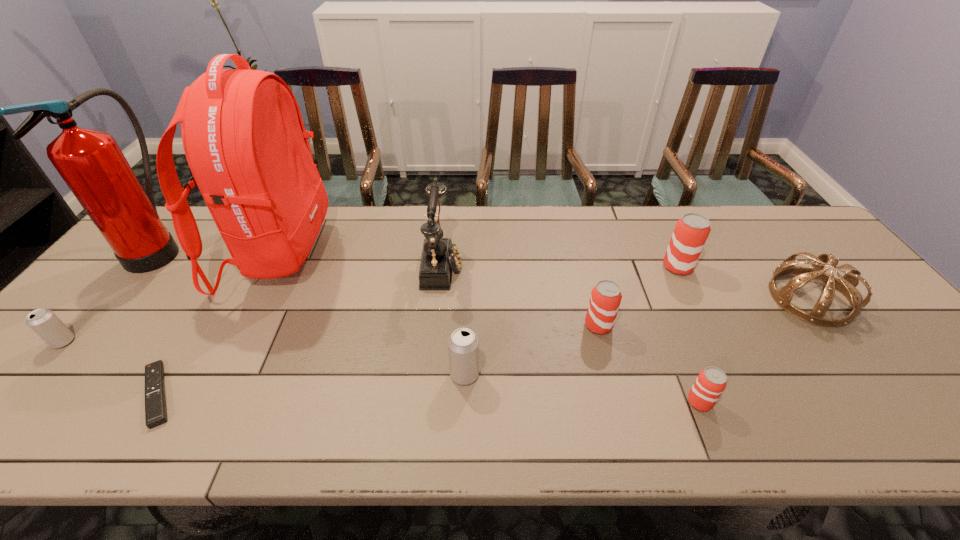
At what (x,y) coordinates should I click in order to perform the action: click on free spot located 0.360m on the front of the biggest orange beer can. Please return your answer as a coordinate pair (x, y). This screenshot has height=540, width=960. Looking at the image, I should click on (737, 388).

Locate an element on the screen. vacant space located on the back of the tiara is located at coordinates (742, 208).

Locate an element on the screen. The width and height of the screenshot is (960, 540). vacant space located 0.250m on the front of the second nearest orange beer can is located at coordinates (626, 431).

Where is `free space located 0.190m on the right of the bigger white beer can`? free space located 0.190m on the right of the bigger white beer can is located at coordinates (563, 374).

Where is `vacant space located 0.120m on the back of the smaller white beer can`? This screenshot has height=540, width=960. vacant space located 0.120m on the back of the smaller white beer can is located at coordinates (101, 299).

At what (x,y) coordinates should I click in order to perform the action: click on vacant area situated on the left of the nearest beer can. Please return your answer as a coordinate pair (x, y). Looking at the image, I should click on pos(641,402).

In order to click on blank space located on the right of the remote control in this screenshot , I will do `click(321, 394)`.

This screenshot has height=540, width=960. I want to click on backpack present at the far edge, so click(243, 135).

Where is `fire extinguisher that is positioned at the far edge`? The image size is (960, 540). fire extinguisher that is positioned at the far edge is located at coordinates (91, 163).

Locate an element on the screen. Image resolution: width=960 pixels, height=540 pixels. telephone present at the far edge is located at coordinates (439, 256).